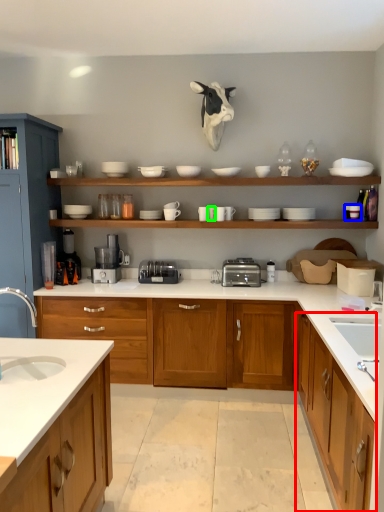
Question: Based on their relative distances, which object is farther from cabinetry (highlighted by a red box)? Choose from tableware (highlighted by a blue box) and tableware (highlighted by a green box).

Choices:
 (A) tableware
 (B) tableware

Answer: (B)